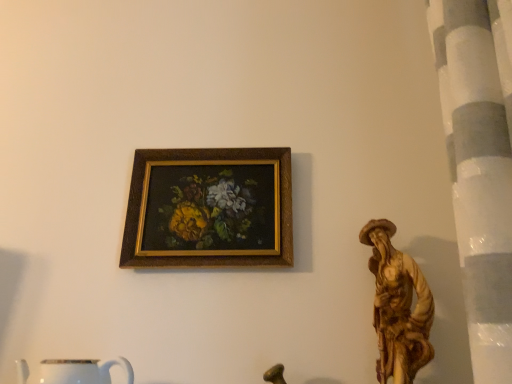
Question: Can you confirm if white glossy mug at lower left is smaller than wooden frame at upper center?

Choices:
 (A) yes
 (B) no

Answer: (B)

Question: Could you tell me if white glossy mug at lower left is turned towards wooden frame at upper center?

Choices:
 (A) no
 (B) yes

Answer: (A)

Question: Is white glossy mug at lower left far from wooden frame at upper center?

Choices:
 (A) no
 (B) yes

Answer: (A)

Question: Is white glossy mug at lower left to the left of wooden frame at upper center from the viewer's perspective?

Choices:
 (A) no
 (B) yes

Answer: (B)

Question: Considering the relative positions of white glossy mug at lower left and wooden frame at upper center in the image provided, is white glossy mug at lower left to the right of wooden frame at upper center from the viewer's perspective?

Choices:
 (A) no
 (B) yes

Answer: (A)

Question: Can you confirm if white glossy mug at lower left is taller than wooden frame at upper center?

Choices:
 (A) yes
 (B) no

Answer: (B)

Question: Is wooden frame at upper center bigger than white glossy mug at lower left?

Choices:
 (A) yes
 (B) no

Answer: (B)

Question: Is wooden frame at upper center shorter than white glossy mug at lower left?

Choices:
 (A) no
 (B) yes

Answer: (A)

Question: Does wooden frame at upper center appear on the left side of white glossy mug at lower left?

Choices:
 (A) yes
 (B) no

Answer: (B)

Question: Considering the relative positions of wooden frame at upper center and white glossy mug at lower left in the image provided, is wooden frame at upper center behind white glossy mug at lower left?

Choices:
 (A) yes
 (B) no

Answer: (A)

Question: Is white glossy mug at lower left a part of wooden frame at upper center?

Choices:
 (A) no
 (B) yes

Answer: (A)

Question: Is wooden frame at upper center outside of white glossy mug at lower left?

Choices:
 (A) no
 (B) yes

Answer: (B)

Question: Is point (60, 380) closer or farther from the camera than point (135, 256)?

Choices:
 (A) farther
 (B) closer

Answer: (B)